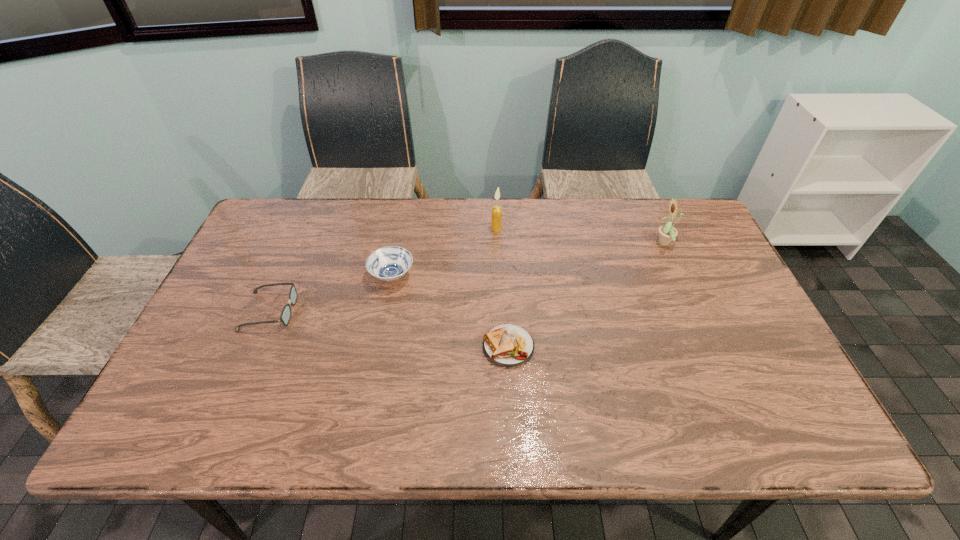
Where is `free space between the sandwich and the soup bowl`? The width and height of the screenshot is (960, 540). free space between the sandwich and the soup bowl is located at coordinates (450, 311).

At what (x,y) coordinates should I click in order to perform the action: click on free space between the second shortest object and the sandwich. Please return your answer as a coordinate pair (x, y). The image size is (960, 540). Looking at the image, I should click on (389, 329).

This screenshot has height=540, width=960. I want to click on empty space between the leftmost object and the shortest object, so click(x=389, y=329).

This screenshot has width=960, height=540. In order to click on free area in between the candle and the soup bowl in this screenshot , I will do `click(444, 253)`.

The width and height of the screenshot is (960, 540). What are the coordinates of `unoccupied position between the soup bowl and the sunflower` in the screenshot? It's located at (529, 260).

Where is `object that is the third closest one to the farthest object`? This screenshot has width=960, height=540. object that is the third closest one to the farthest object is located at coordinates (667, 233).

Where is `the fourth closest object to the farthest object`? The image size is (960, 540). the fourth closest object to the farthest object is located at coordinates (285, 316).

The height and width of the screenshot is (540, 960). Identify the location of vacant area that satisfies the following two spatial constraints: 1. on the front-facing side of the sunflower; 2. on the front side of the shortest object. (x=709, y=346).

Identify the location of vacant region that satisfies the following two spatial constraints: 1. on the front-facing side of the sunflower; 2. on the front side of the shortest object. (709, 346).

Locate an element on the screen. Image resolution: width=960 pixels, height=540 pixels. blank area in the image that satisfies the following two spatial constraints: 1. on the front side of the farthest object; 2. on the face of the spectacles is located at coordinates (500, 311).